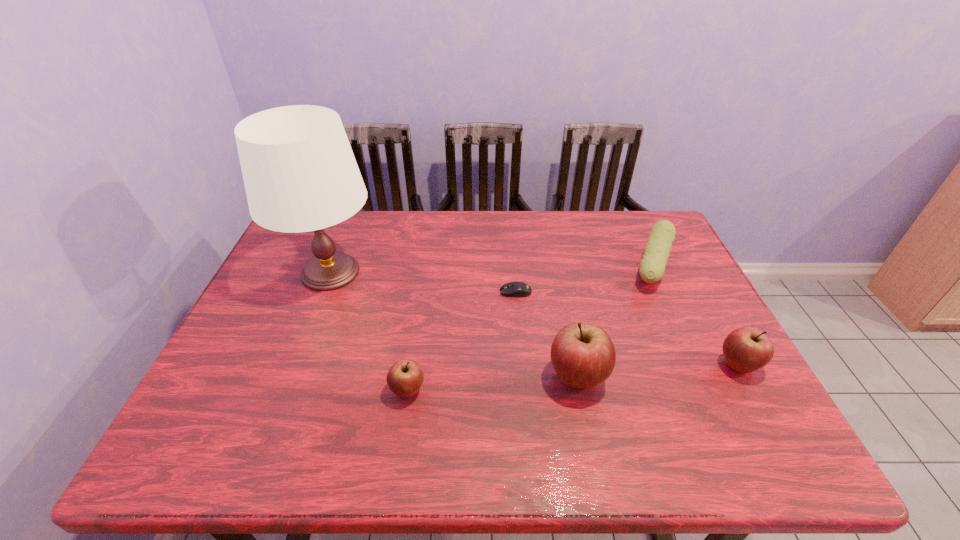
Image resolution: width=960 pixels, height=540 pixels. I want to click on cucumber that is at the far edge, so click(657, 250).

Where is `object located at the left edge`? object located at the left edge is located at coordinates (300, 174).

Where is `apple located at the right edge`? The width and height of the screenshot is (960, 540). apple located at the right edge is located at coordinates (746, 349).

Identify the location of cucumber at the right edge. (657, 250).

Where is `object that is at the far left corner`? The image size is (960, 540). object that is at the far left corner is located at coordinates [300, 174].

Find the location of `object that is at the far right corner`. object that is at the far right corner is located at coordinates (657, 250).

Locate an element on the screen. free space at the far edge is located at coordinates (351, 231).

The image size is (960, 540). I want to click on vacant space at the near edge, so click(x=466, y=403).

The width and height of the screenshot is (960, 540). Identify the location of free region at the left edge. pyautogui.click(x=275, y=330).

This screenshot has width=960, height=540. In the image, there is a desktop. In order to click on vacant space at the far left corner in this screenshot , I will do `click(290, 243)`.